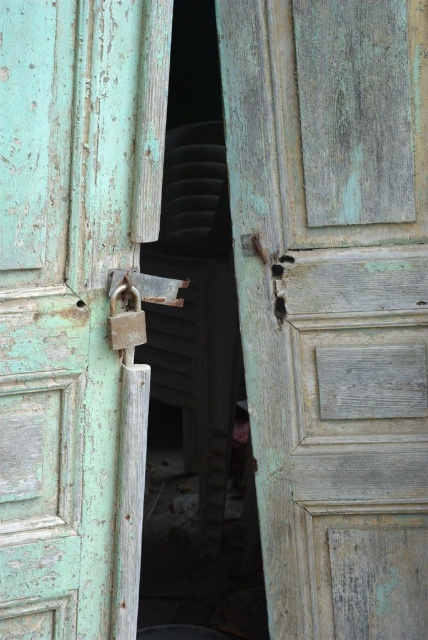
You are standing in front of the weathered wooden door with a teal green paint. There is a point at coordinate [136,304] on the door. What object is located at that point?

The point at coordinate [136,304] corresponds to the metallic padlock at center.

You are a security guard inspecting the entrance. You notice the peeling teal wood door at center and the rusty metal padlock at center. Based on their sizes, which object would require more force to remove from its current position?

The peeling teal wood door at center is larger than the rusty metal padlock at center, so it would require more force to remove from its current position.